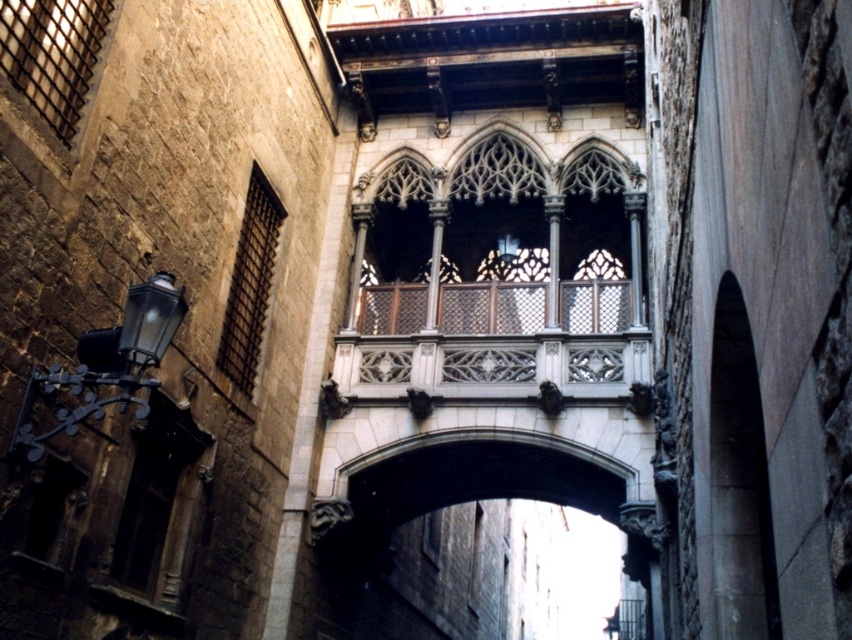
Question: Does white stone balcony at center appear on the left side of smooth stone archway at center?

Choices:
 (A) yes
 (B) no

Answer: (A)

Question: Does white stone balcony at center appear over smooth stone archway at center?

Choices:
 (A) no
 (B) yes

Answer: (B)

Question: Is white stone balcony at center wider than smooth stone archway at center?

Choices:
 (A) yes
 (B) no

Answer: (B)